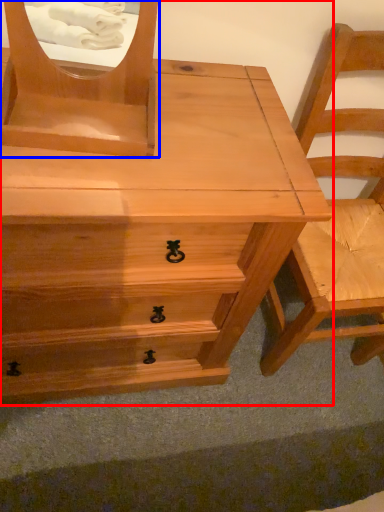
Question: Among these objects, which one is nearest to the camera, chest of drawers (highlighted by a red box) or mirror (highlighted by a blue box)?

Choices:
 (A) chest of drawers
 (B) mirror

Answer: (B)